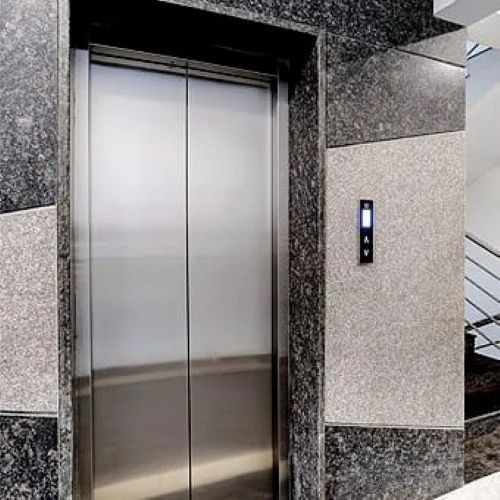
The width and height of the screenshot is (500, 500). I want to click on stair rail, so click(480, 268).